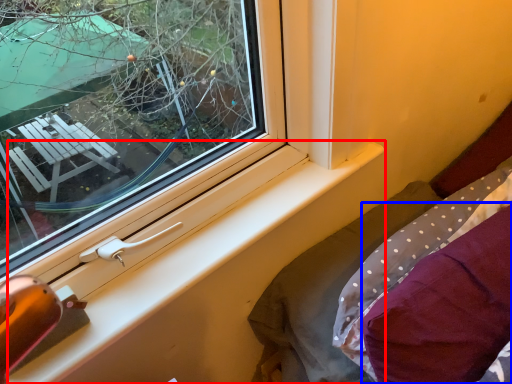
Question: Which object is further to the camera taking this photo, window sill (highlighted by a red box) or pillow (highlighted by a blue box)?

Choices:
 (A) window sill
 (B) pillow

Answer: (A)